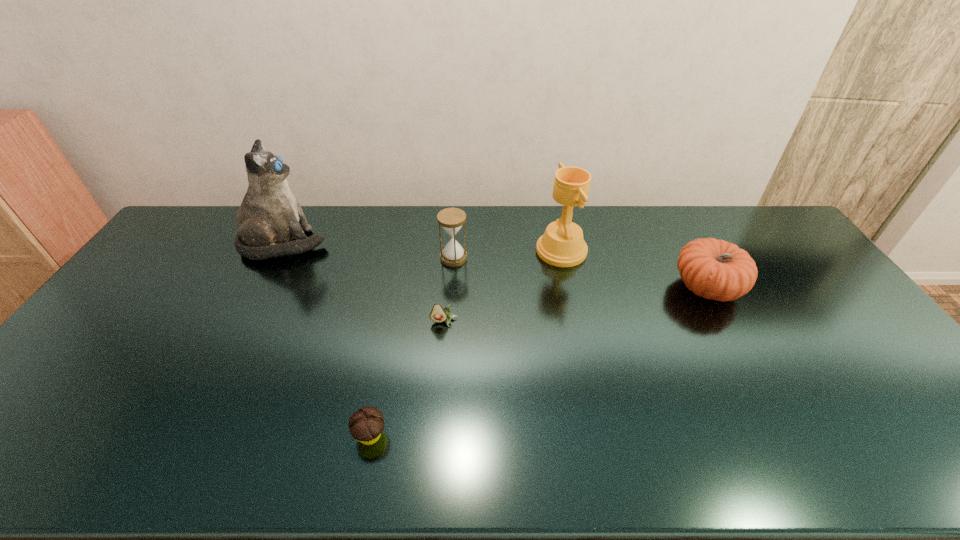
The width and height of the screenshot is (960, 540). In the image, there is a desktop. In order to click on free space at the near edge in this screenshot , I will do `click(556, 471)`.

In the image, there is a desktop. At what (x,y) coordinates should I click in order to perform the action: click on vacant space at the left edge. Please return your answer as a coordinate pair (x, y). The height and width of the screenshot is (540, 960). Looking at the image, I should click on (126, 304).

I want to click on free space at the right edge of the desktop, so click(828, 311).

You are a GUI agent. You are given a task and a screenshot of the screen. Output one action in this format:
    pyautogui.click(x=<x>, y=<y>)
    Task: Click on the free location at the far right corner of the desktop
    The image size is (960, 540).
    Given the screenshot: What is the action you would take?
    pyautogui.click(x=779, y=244)

Where is `free space that is in between the avocado and the hourglass`? This screenshot has height=540, width=960. free space that is in between the avocado and the hourglass is located at coordinates (449, 290).

What are the coordinates of `empty location between the hourglass and the fifth farthest object` in the screenshot? It's located at (449, 290).

You are a GUI agent. You are given a task and a screenshot of the screen. Output one action in this format:
    pyautogui.click(x=<x>, y=<y>)
    Task: Click on the free space between the fifth object from right to left and the second nearest object
    
    Given the screenshot: What is the action you would take?
    pyautogui.click(x=407, y=379)

Where is `free space that is in between the muffin and the rightmost object`? The image size is (960, 540). free space that is in between the muffin and the rightmost object is located at coordinates (539, 361).

Find the location of a particular element. vacant point located between the nearest object and the avocado is located at coordinates (407, 379).

At what (x,y) coordinates should I click in order to perform the action: click on free space between the second object from right to left and the fifth object from right to left. Please return your answer as a coordinate pair (x, y). Image resolution: width=960 pixels, height=540 pixels. Looking at the image, I should click on pyautogui.click(x=466, y=343).